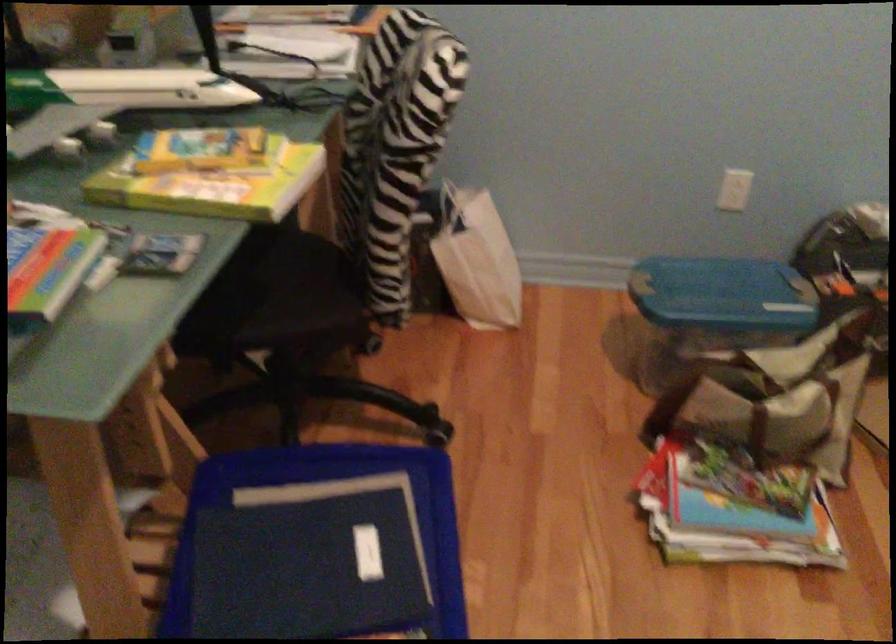
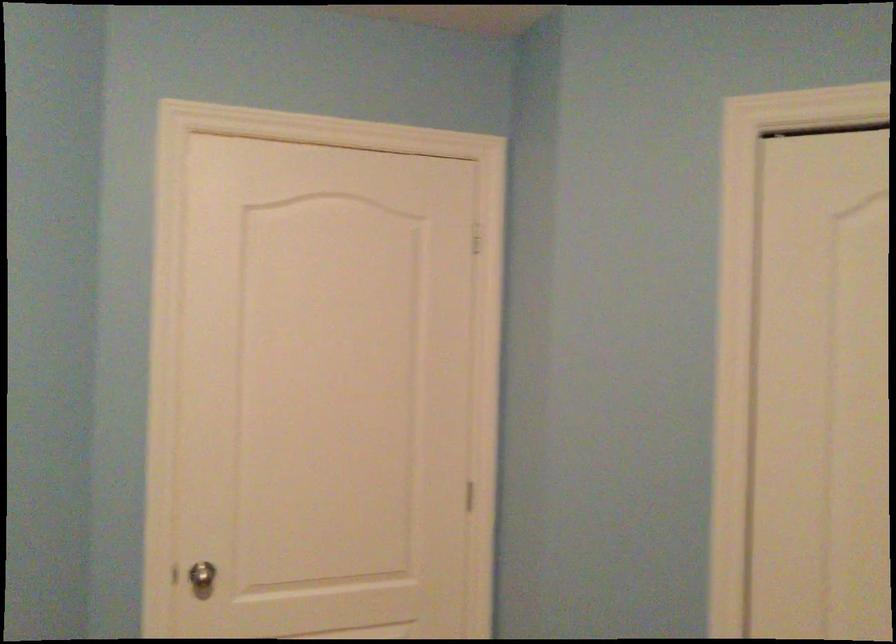
Question: The images are taken continuously from a first-person perspective. In which direction is your viewpoint rotating?

Choices:
 (A) Left
 (B) Right
 (C) Up
 (D) Down

Answer: (B)